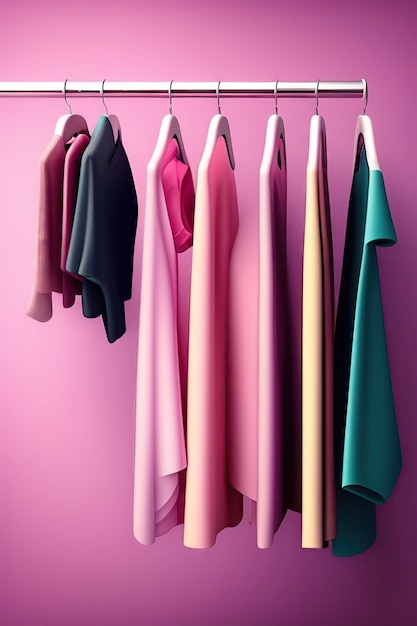
Generate point markers for all how many hangers are shown in the image. Your answer should be formatted as a list of tuples, i.e. [(x1, y1), (x2, y2), ...], where each tuple contains the x and y coordinates of a point satisfying the conditions above.

[(366, 126), (315, 136), (273, 131), (218, 126), (164, 130), (103, 134), (65, 126)]